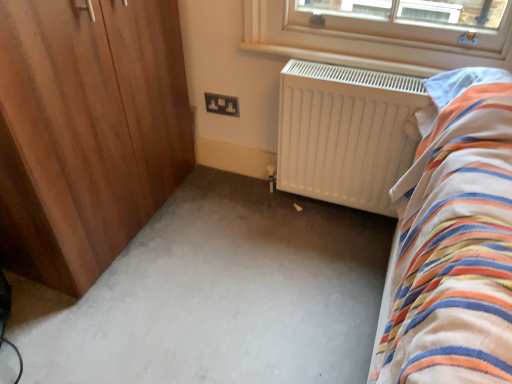
Find the location of `blank area beneath white matte radiator at center (from a real-world perspective)`. blank area beneath white matte radiator at center (from a real-world perspective) is located at coordinates (338, 207).